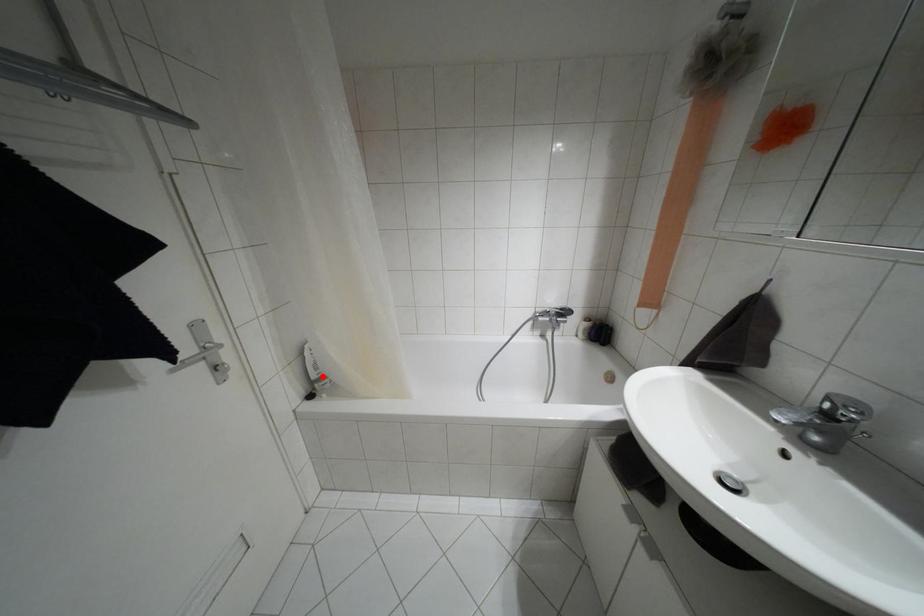
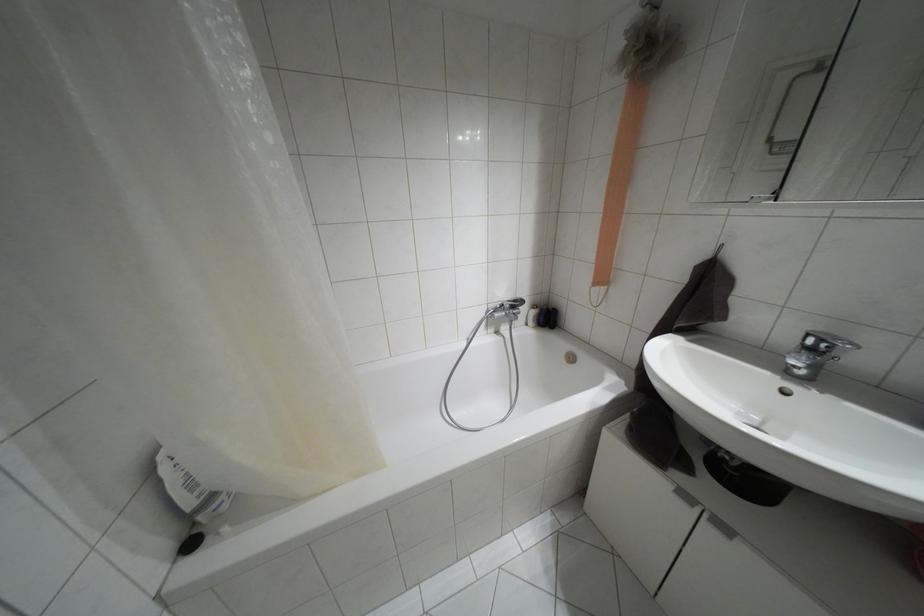
The point at the highlighted location is marked in the first image. Where is the corresponding point in the second image?

(212, 496)